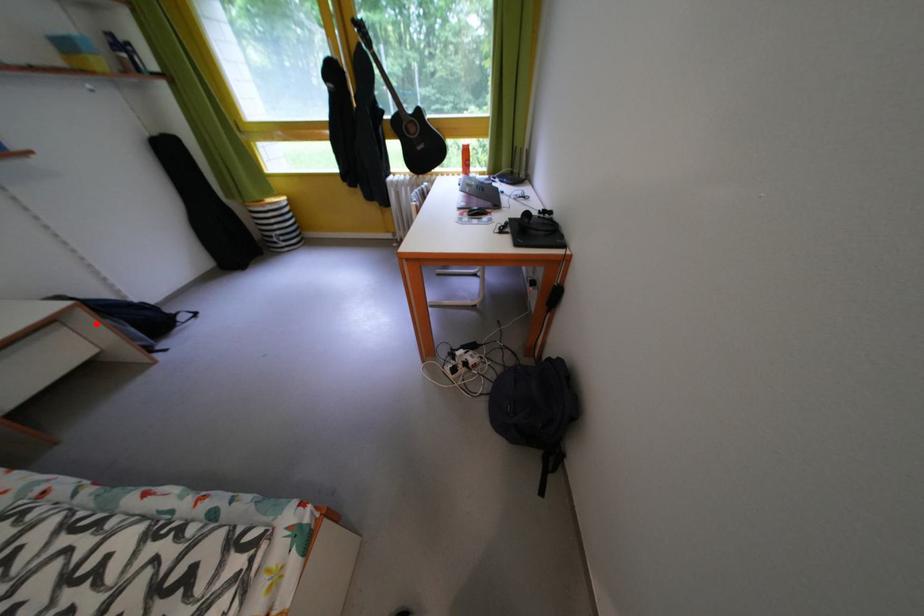
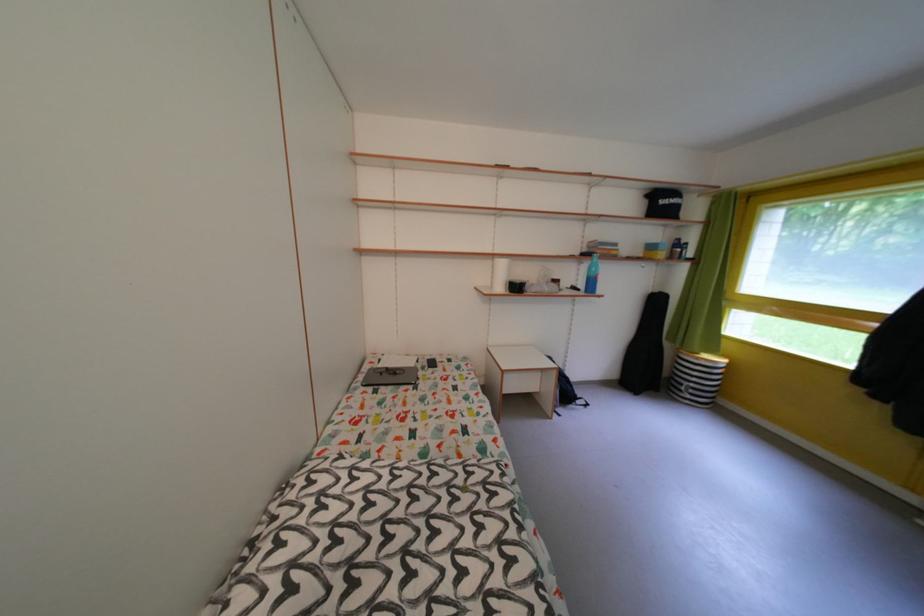
Where in the second image is the point corresponding to the highlighted location from the first image?

(563, 382)